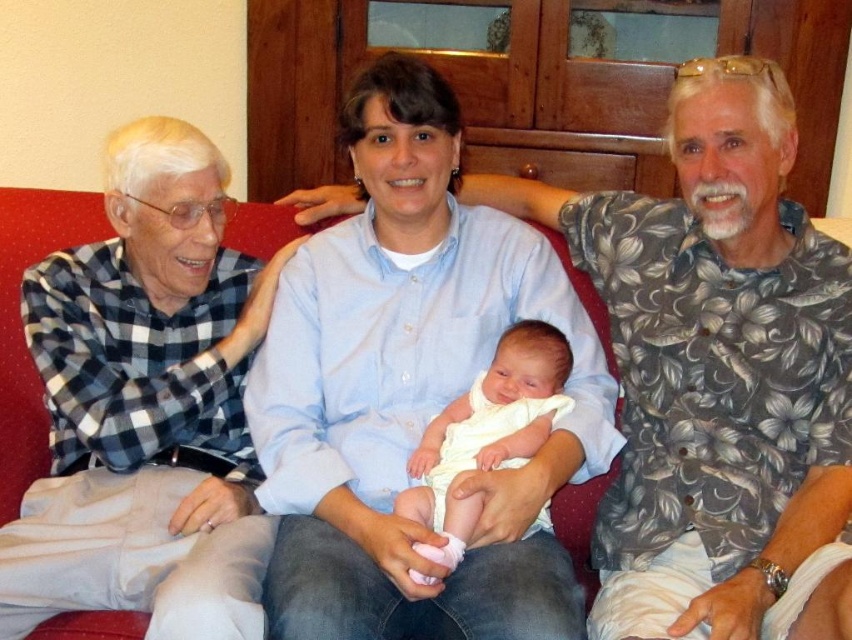
Question: Among these objects, which one is farthest from the camera?

Choices:
 (A) checkered fabric shirt at left
 (B) white clothed baby at center
 (C) light blue button-down shirt at center

Answer: (B)

Question: Estimate the real-world distances between objects in this image. Which object is farther from the light blue button-down shirt at center?

Choices:
 (A) checkered fabric shirt at left
 (B) white clothed baby at center

Answer: (A)

Question: Can you confirm if light blue button-down shirt at center is smaller than checkered fabric shirt at left?

Choices:
 (A) yes
 (B) no

Answer: (B)

Question: Which point is closer to the camera?

Choices:
 (A) (427, 435)
 (B) (386, 134)

Answer: (A)

Question: Can you confirm if checkered fabric shirt at left is positioned to the right of white clothed baby at center?

Choices:
 (A) no
 (B) yes

Answer: (A)

Question: In this image, where is checkered fabric shirt at left located relative to white clothed baby at center?

Choices:
 (A) below
 (B) above

Answer: (B)